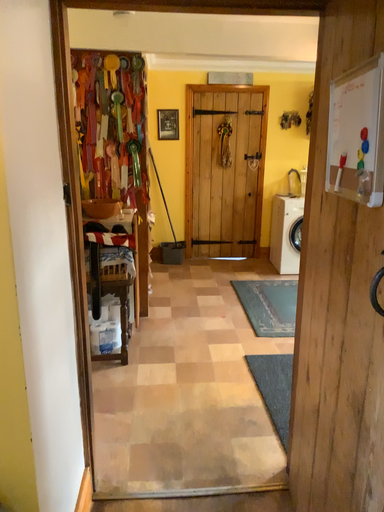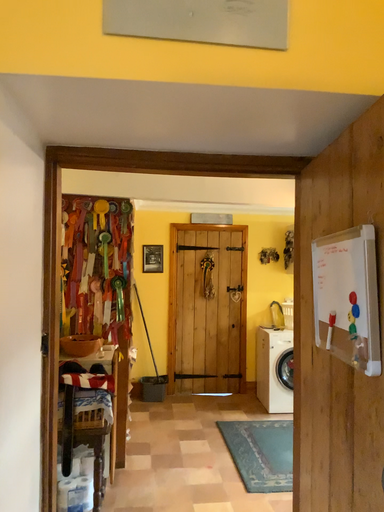
Question: Which way did the camera rotate in the video?

Choices:
 (A) rotated upward
 (B) rotated downward

Answer: (A)